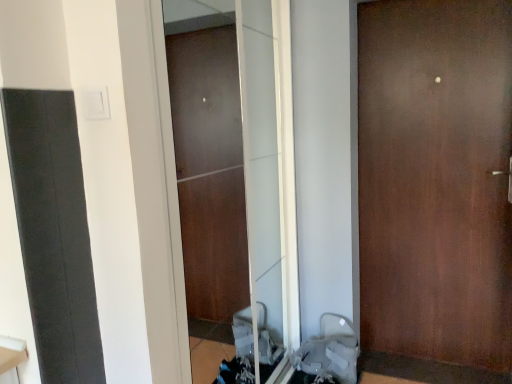
Question: Can you confirm if gray fabric baby carriage at lower right is smaller than brown matte door at center?

Choices:
 (A) yes
 (B) no

Answer: (A)

Question: Is gray fabric baby carriage at lower right positioned in front of brown matte door at center?

Choices:
 (A) yes
 (B) no

Answer: (B)

Question: From a real-world perspective, is gray fabric baby carriage at lower right physically above brown matte door at center?

Choices:
 (A) yes
 (B) no

Answer: (B)

Question: Does gray fabric baby carriage at lower right have a greater height compared to brown matte door at center?

Choices:
 (A) no
 (B) yes

Answer: (A)

Question: Can brown matte door at center be found inside gray fabric baby carriage at lower right?

Choices:
 (A) yes
 (B) no

Answer: (B)

Question: Looking at their shapes, would you say transparent glass screen door at center is wider or thinner than gray fabric baby carriage at lower right?

Choices:
 (A) wide
 (B) thin

Answer: (B)

Question: From the image's perspective, relative to gray fabric baby carriage at lower right, is transparent glass screen door at center above or below?

Choices:
 (A) below
 (B) above

Answer: (B)

Question: Based on their positions, is transparent glass screen door at center located to the left or right of gray fabric baby carriage at lower right?

Choices:
 (A) left
 (B) right

Answer: (A)

Question: Considering the positions of point (252, 304) and point (321, 359), is point (252, 304) closer or farther from the camera than point (321, 359)?

Choices:
 (A) closer
 (B) farther

Answer: (B)

Question: Considering the positions of brown matte door at center and transparent glass screen door at center in the image, is brown matte door at center taller or shorter than transparent glass screen door at center?

Choices:
 (A) tall
 (B) short

Answer: (A)

Question: From a real-world perspective, relative to transparent glass screen door at center, is brown matte door at center vertically above or below?

Choices:
 (A) above
 (B) below

Answer: (B)

Question: Based on their sizes in the image, would you say brown matte door at center is bigger or smaller than transparent glass screen door at center?

Choices:
 (A) big
 (B) small

Answer: (A)

Question: Is brown matte door at center in front of or behind transparent glass screen door at center in the image?

Choices:
 (A) behind
 (B) front

Answer: (A)

Question: In the image, is brown matte door at center on the left side or the right side of gray fabric baby carriage at lower right?

Choices:
 (A) right
 (B) left

Answer: (A)

Question: From the image's perspective, is brown matte door at center located above or below gray fabric baby carriage at lower right?

Choices:
 (A) above
 (B) below

Answer: (A)